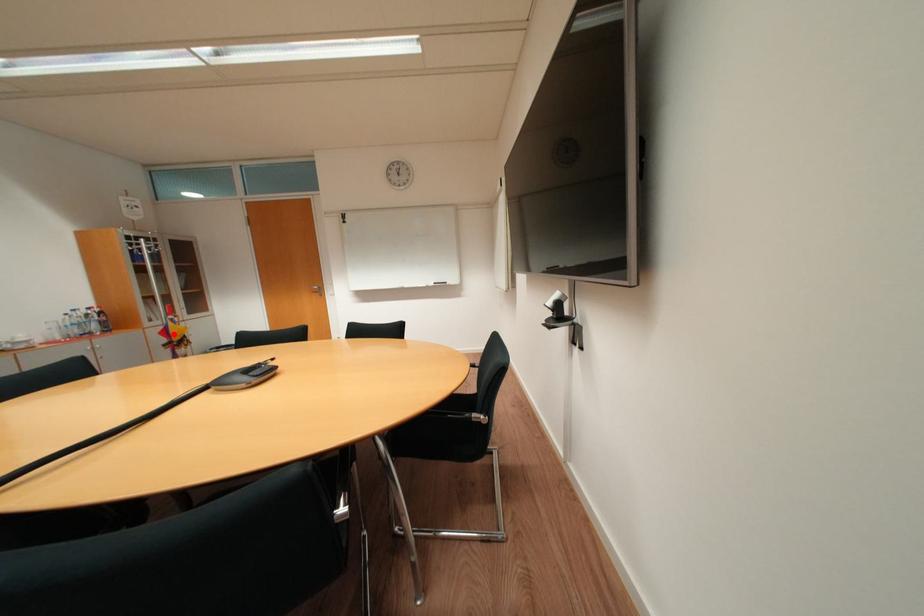
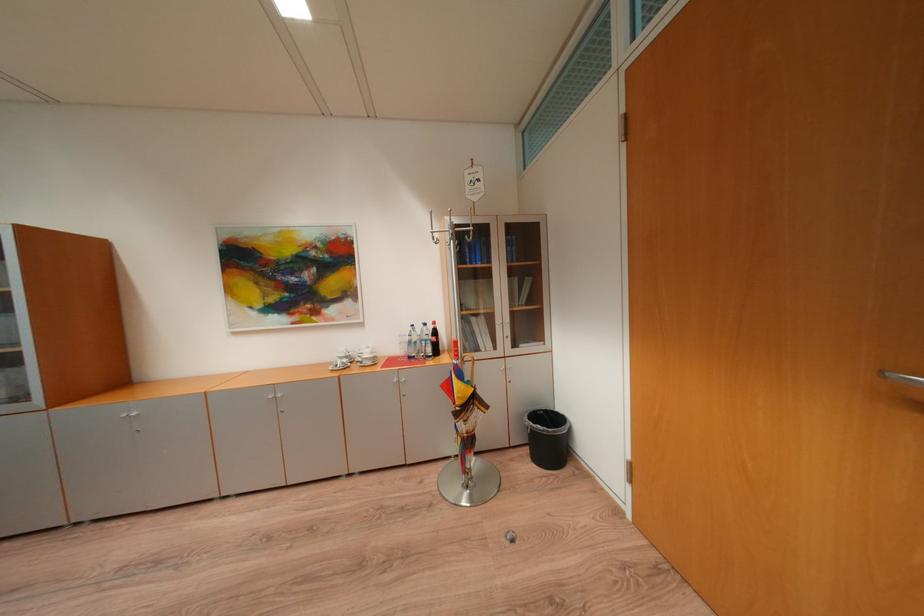
Question: I am providing you with two images of the same scene from different viewpoints. In image1, a red point is highlighted. Considering the same 3D point in image2, which of the following is correct?

Choices:
 (A) It is closer
 (B) It is farther

Answer: (B)